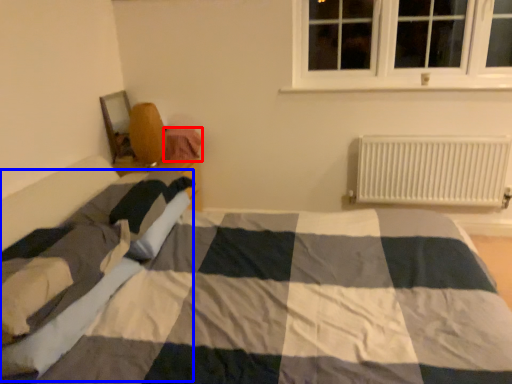
Question: Which of the following is the closest to the observer, material (highlighted by a red box) or blanket (highlighted by a blue box)?

Choices:
 (A) material
 (B) blanket

Answer: (B)